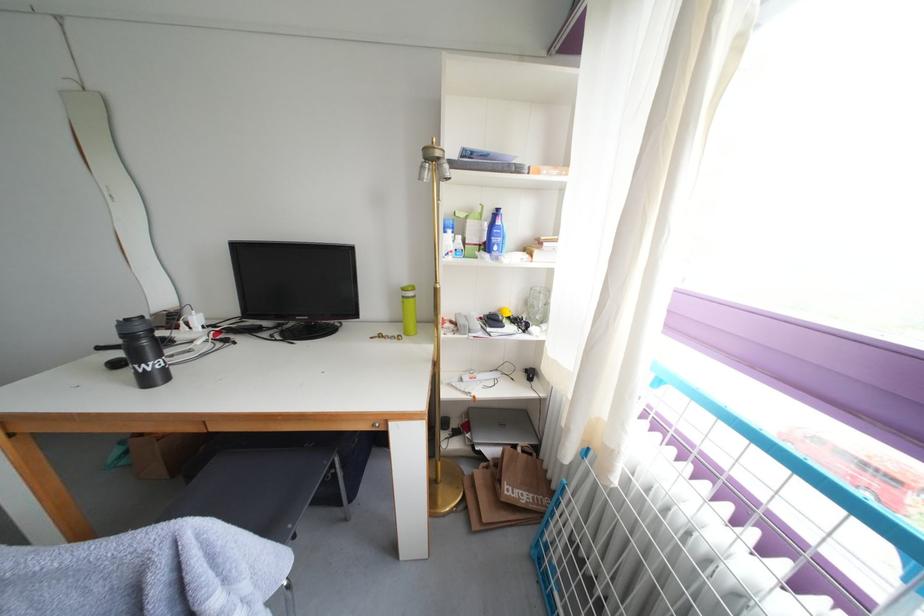
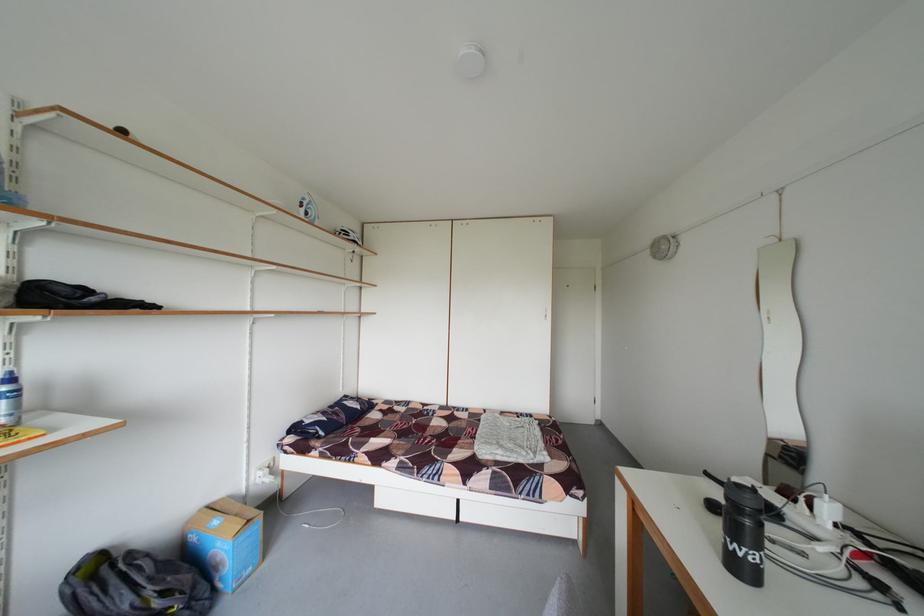
Find the pixel in the second image that matches (x=150, y=334) in the first image.

(759, 507)